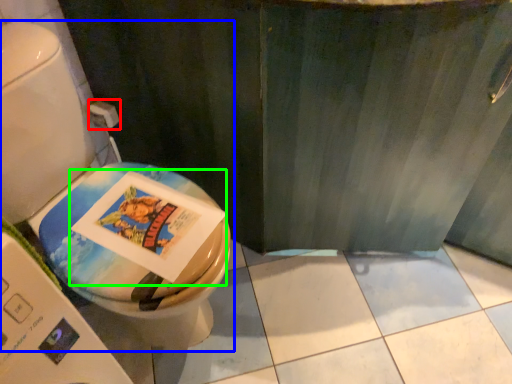
Question: Based on their relative distances, which object is farther from toilet paper (highlighted by a red box)? Choose from toilet (highlighted by a blue box) and comic book (highlighted by a green box).

Choices:
 (A) toilet
 (B) comic book

Answer: (B)